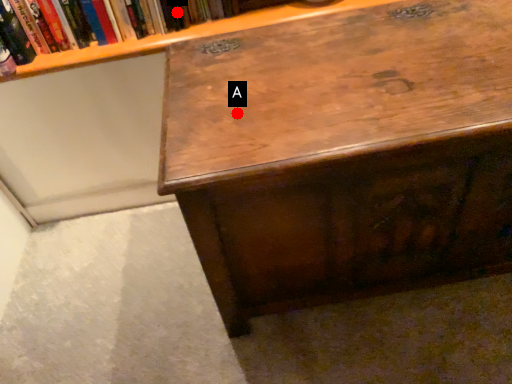
Question: Two points are circled on the image, labeled by A and B beside each circle. Which point is closer to the camera?

Choices:
 (A) A is closer
 (B) B is closer

Answer: (A)